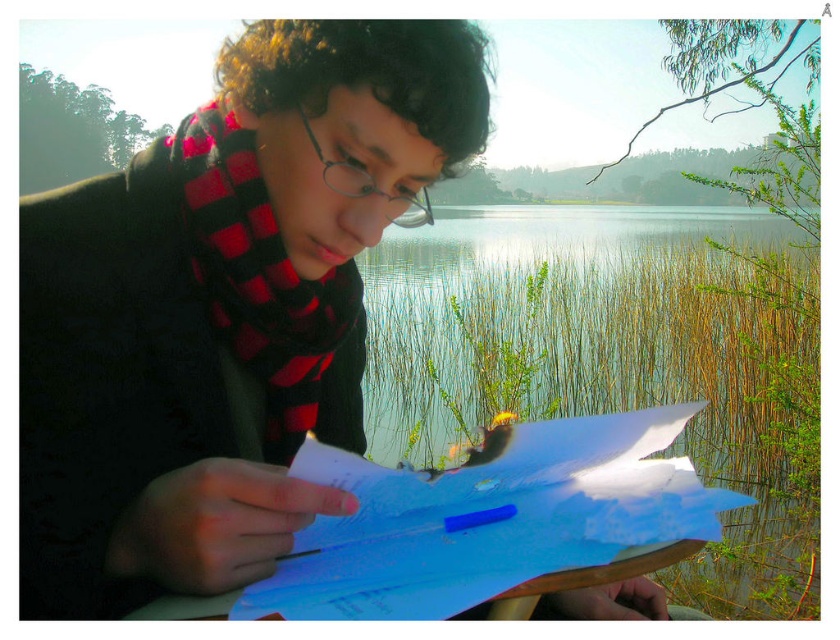
Question: Is matte black scarf at upper left positioned before red plaid scarf at center?

Choices:
 (A) no
 (B) yes

Answer: (B)

Question: Can you confirm if clear water at center is smaller than white paper at center?

Choices:
 (A) yes
 (B) no

Answer: (B)

Question: Is matte black scarf at upper left smaller than white paper at center?

Choices:
 (A) no
 (B) yes

Answer: (A)

Question: Which point appears closest to the camera in this image?

Choices:
 (A) (413, 221)
 (B) (760, 618)
 (C) (438, 481)

Answer: (C)

Question: Which point is farther to the camera?

Choices:
 (A) red plaid scarf at center
 (B) matte black scarf at upper left
 (C) clear water at center
 (D) white paper at center

Answer: (C)

Question: Which point appears farthest from the camera in this image?

Choices:
 (A) (240, 285)
 (B) (555, 456)
 (C) (252, 284)

Answer: (A)